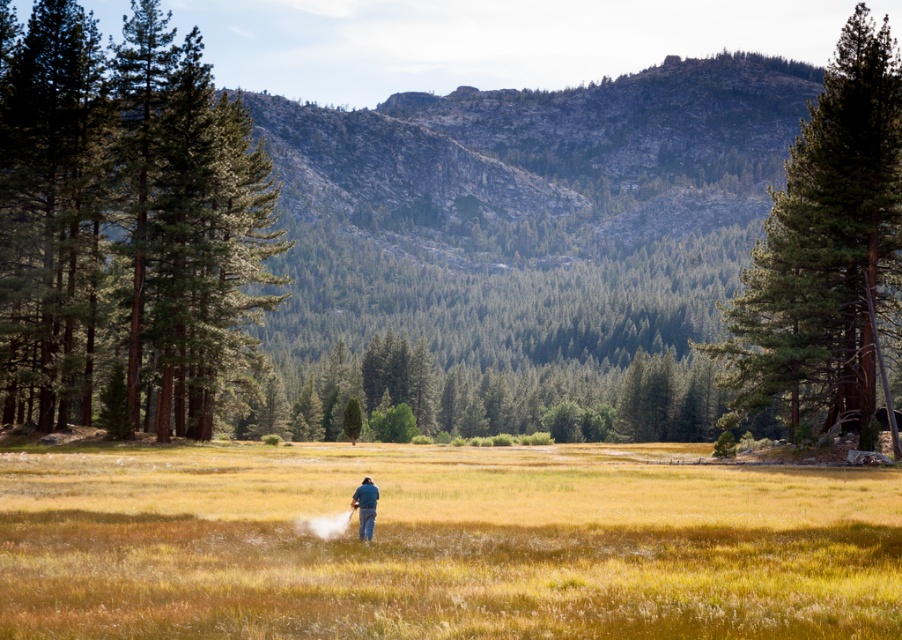
Is green textured pine trees at left bigger than blue denim jeans at center?

Yes, green textured pine trees at left is bigger than blue denim jeans at center.

Is green textured pine trees at left above blue denim jeans at center?

Yes.

Where is `green textured pine trees at left`? The height and width of the screenshot is (640, 902). green textured pine trees at left is located at coordinates (125, 224).

Does green textured pine trees at left lie in front of green textured tree at right?

No.

Can you confirm if green textured pine trees at left is positioned to the left of green textured tree at right?

Correct, you'll find green textured pine trees at left to the left of green textured tree at right.

Is point (205, 435) closer to camera compared to point (767, 328)?

No, it is behind (767, 328).

What are the coordinates of `green textured pine trees at left` in the screenshot? It's located at (125, 224).

Can you confirm if green textured tree at right is taller than blue denim jeans at center?

Indeed, green textured tree at right has a greater height compared to blue denim jeans at center.

Which is in front, point (827, 182) or point (367, 515)?

Positioned in front is point (367, 515).

Identify the location of green textured tree at right. The width and height of the screenshot is (902, 640). (827, 252).